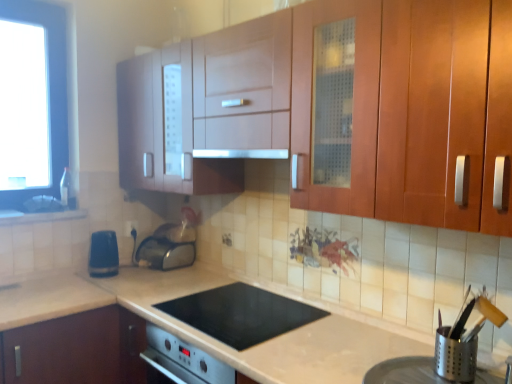
The image size is (512, 384). Identify the location of vacant point to the left of silver metallic utensil holder at lower right, the 2th appliance from the front. (404, 368).